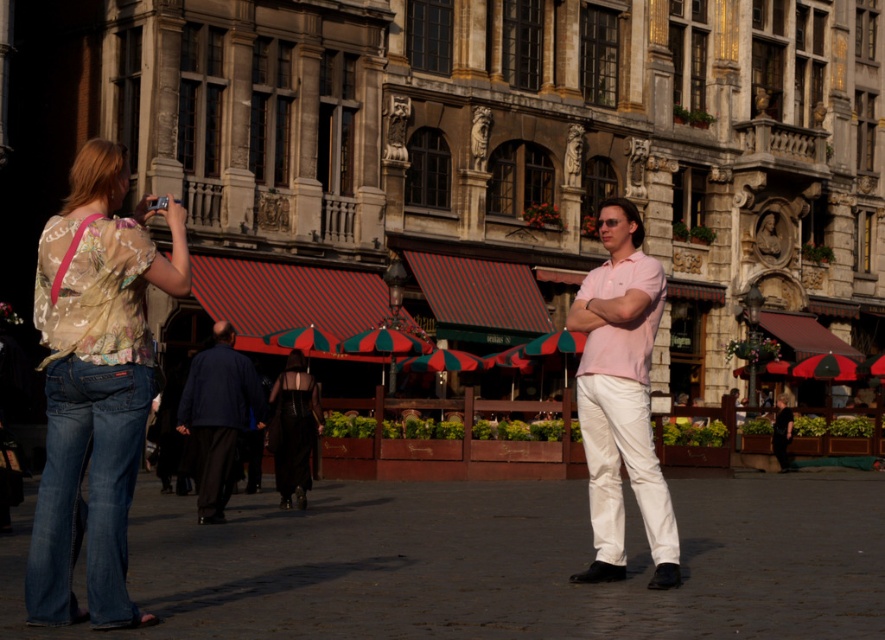
You are a photographer trying to capture the man in the foreground on the right and the woman taking a photo with her phone to the left of him. You want to ensure both subjects are in focus. Given their positions at coordinates point (94,561) and point (222,332) respectively, which subject should you focus on to ensure both are sharp?

Since point (94,561) is closer to the camera than point (222,332), you should focus on the subject at point (94,561). This will ensure both subjects are in focus as the closer subject establishes the focal plane, and the second point falls within the depth of field.

You are a photographer planning to capture a candid shot of the matte pink shirt at center and the dark blue fabric jacket at center in the scene. If your camera frame can only accommodate one of them fully, which one should you prioritize to fit within the frame based on their widths?

The matte pink shirt at center might be wider than dark blue fabric jacket at center, so prioritizing the matte pink shirt at center ensures it fits within the frame.

You are a fashion designer analyzing the outfits in the scene. Which of the two items, the matte pink shirt at center or the dark blue fabric jacket at center, has a greater height measurement?

The matte pink shirt at center is taller than the dark blue fabric jacket at center.